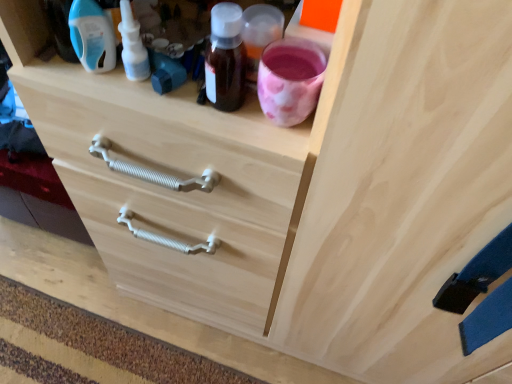
Locate an element on the screen. The image size is (512, 384). natural wood drawer at center is located at coordinates (175, 191).

Where is `blue plastic bottle at upper left, which ranks as the 1th bottle in left-to-right order`? This screenshot has width=512, height=384. blue plastic bottle at upper left, which ranks as the 1th bottle in left-to-right order is located at coordinates (92, 36).

From the image's perspective, which is above, natural wood drawer at center or blue plastic bottle at upper left, the 2th bottle in the right-to-left sequence?

blue plastic bottle at upper left, the 2th bottle in the right-to-left sequence.

Does natural wood drawer at center have a smaller size compared to blue plastic bottle at upper left, the 2th bottle in the right-to-left sequence?

Incorrect, natural wood drawer at center is not smaller in size than blue plastic bottle at upper left, the 2th bottle in the right-to-left sequence.

Is point (202, 129) behind point (113, 35)?

No, (202, 129) is closer to viewer.

Is point (204, 203) positioned behind point (139, 25)?

Yes, point (204, 203) is farther from viewer.

Which of these two, natural wood drawer at center or white plastic nasal spray at upper left, the 2th bottle viewed from the left, is wider?

natural wood drawer at center.

Visually, is natural wood drawer at center positioned to the left or to the right of white plastic nasal spray at upper left, the 2th bottle viewed from the left?

Based on their positions, natural wood drawer at center is located to the left of white plastic nasal spray at upper left, the 2th bottle viewed from the left.

Is natural wood drawer at center inside the boundaries of white plastic nasal spray at upper left, the 2th bottle viewed from the left, or outside?

natural wood drawer at center is located beyond the bounds of white plastic nasal spray at upper left, the 2th bottle viewed from the left.

Is white plastic nasal spray at upper left, acting as the first bottle starting from the right, facing away from blue plastic bottle at upper left, the 2th bottle in the right-to-left sequence?

No.

Which point is more forward, (143, 58) or (82, 37)?

The point (82, 37) is closer.

Does white plastic nasal spray at upper left, acting as the first bottle starting from the right, have a smaller size compared to blue plastic bottle at upper left, the 2th bottle in the right-to-left sequence?

Yes, white plastic nasal spray at upper left, acting as the first bottle starting from the right, is smaller than blue plastic bottle at upper left, the 2th bottle in the right-to-left sequence.

From the image's perspective, does white plastic nasal spray at upper left, the 2th bottle viewed from the left, appear higher than blue plastic bottle at upper left, which ranks as the 1th bottle in left-to-right order?

No, from the image's perspective, white plastic nasal spray at upper left, the 2th bottle viewed from the left, is not over blue plastic bottle at upper left, which ranks as the 1th bottle in left-to-right order.

Is blue plastic bottle at upper left, which ranks as the 1th bottle in left-to-right order, facing towards natural wood drawer at center?

No, blue plastic bottle at upper left, which ranks as the 1th bottle in left-to-right order, is not aimed at natural wood drawer at center.

From the image's perspective, starting from the natural wood drawer at center, which bottle is the 2nd one above? Please provide its 2D coordinates.

[(92, 36)]

Is blue plastic bottle at upper left, the 2th bottle in the right-to-left sequence, taller than natural wood drawer at center?

Yes, blue plastic bottle at upper left, the 2th bottle in the right-to-left sequence, is taller than natural wood drawer at center.

Would you say natural wood drawer at center is part of blue plastic bottle at upper left, which ranks as the 1th bottle in left-to-right order,'s contents?

No, natural wood drawer at center is not inside blue plastic bottle at upper left, which ranks as the 1th bottle in left-to-right order.

Is white plastic nasal spray at upper left, acting as the first bottle starting from the right, far from natural wood drawer at center?

No, white plastic nasal spray at upper left, acting as the first bottle starting from the right, is in close proximity to natural wood drawer at center.

Is point (130, 20) closer or farther from the camera than point (193, 308)?

Point (130, 20) appears to be closer to the viewer than point (193, 308).

From a real-world perspective, is white plastic nasal spray at upper left, acting as the first bottle starting from the right, located beneath natural wood drawer at center?

No, from a real-world perspective, white plastic nasal spray at upper left, acting as the first bottle starting from the right, is not under natural wood drawer at center.

Where is `drawer below the white plastic nasal spray at upper left, the 2th bottle viewed from the left (from a real-world perspective)`? The height and width of the screenshot is (384, 512). drawer below the white plastic nasal spray at upper left, the 2th bottle viewed from the left (from a real-world perspective) is located at coordinates (175, 191).

Can you tell me how much blue plastic bottle at upper left, which ranks as the 1th bottle in left-to-right order, and white plastic nasal spray at upper left, the 2th bottle viewed from the left, differ in facing direction?

There is a 47-degree angle between the facing directions of blue plastic bottle at upper left, which ranks as the 1th bottle in left-to-right order, and white plastic nasal spray at upper left, the 2th bottle viewed from the left.

Based on the photo, considering the relative positions of blue plastic bottle at upper left, the 2th bottle in the right-to-left sequence, and white plastic nasal spray at upper left, the 2th bottle viewed from the left, in the image provided, is blue plastic bottle at upper left, the 2th bottle in the right-to-left sequence, to the right of white plastic nasal spray at upper left, the 2th bottle viewed from the left, from the viewer's perspective?

In fact, blue plastic bottle at upper left, the 2th bottle in the right-to-left sequence, is to the left of white plastic nasal spray at upper left, the 2th bottle viewed from the left.

Does blue plastic bottle at upper left, which ranks as the 1th bottle in left-to-right order, lie in front of white plastic nasal spray at upper left, the 2th bottle viewed from the left?

Yes, it is in front of white plastic nasal spray at upper left, the 2th bottle viewed from the left.

Where is `the 2nd bottle above the natural wood drawer at center (from the image's perspective)`? This screenshot has width=512, height=384. the 2nd bottle above the natural wood drawer at center (from the image's perspective) is located at coordinates (92, 36).

Image resolution: width=512 pixels, height=384 pixels. I want to click on drawer that appears below the white plastic nasal spray at upper left, acting as the first bottle starting from the right (from the image's perspective), so click(175, 191).

When comparing their distances from natural wood drawer at center, does blue plastic bottle at upper left, the 2th bottle in the right-to-left sequence, or white plastic nasal spray at upper left, acting as the first bottle starting from the right, seem closer?

The object closer to natural wood drawer at center is white plastic nasal spray at upper left, acting as the first bottle starting from the right.

Based on their spatial positions, is natural wood drawer at center or white plastic nasal spray at upper left, the 2th bottle viewed from the left, further from blue plastic bottle at upper left, which ranks as the 1th bottle in left-to-right order?

Based on the image, natural wood drawer at center appears to be further to blue plastic bottle at upper left, which ranks as the 1th bottle in left-to-right order.

From the image, which object appears to be nearer to natural wood drawer at center, white plastic nasal spray at upper left, the 2th bottle viewed from the left, or blue plastic bottle at upper left, which ranks as the 1th bottle in left-to-right order?

The object closer to natural wood drawer at center is white plastic nasal spray at upper left, the 2th bottle viewed from the left.

Estimate the real-world distances between objects in this image. Which object is further from white plastic nasal spray at upper left, acting as the first bottle starting from the right, natural wood drawer at center or blue plastic bottle at upper left, which ranks as the 1th bottle in left-to-right order?

Among the two, natural wood drawer at center is located further to white plastic nasal spray at upper left, acting as the first bottle starting from the right.

Which object lies further to the anchor point white plastic nasal spray at upper left, acting as the first bottle starting from the right, blue plastic bottle at upper left, which ranks as the 1th bottle in left-to-right order, or natural wood drawer at center?

natural wood drawer at center is further to white plastic nasal spray at upper left, acting as the first bottle starting from the right.

Looking at this image, based on their spatial positions, is white plastic nasal spray at upper left, acting as the first bottle starting from the right, or natural wood drawer at center further from blue plastic bottle at upper left, the 2th bottle in the right-to-left sequence?

Among the two, natural wood drawer at center is located further to blue plastic bottle at upper left, the 2th bottle in the right-to-left sequence.

Where is `bottle between blue plastic bottle at upper left, which ranks as the 1th bottle in left-to-right order, and natural wood drawer at center from top to bottom`? The image size is (512, 384). bottle between blue plastic bottle at upper left, which ranks as the 1th bottle in left-to-right order, and natural wood drawer at center from top to bottom is located at coordinates (132, 45).